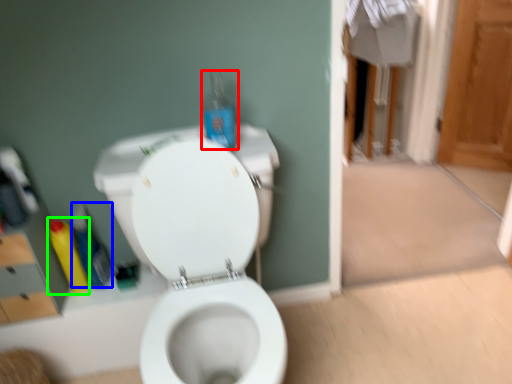
Question: Estimate the real-world distances between objects in this image. Which object is farther from bottle (highlighted by a red box), cleaning product (highlighted by a blue box) or cleaning product (highlighted by a green box)?

Choices:
 (A) cleaning product
 (B) cleaning product

Answer: (B)